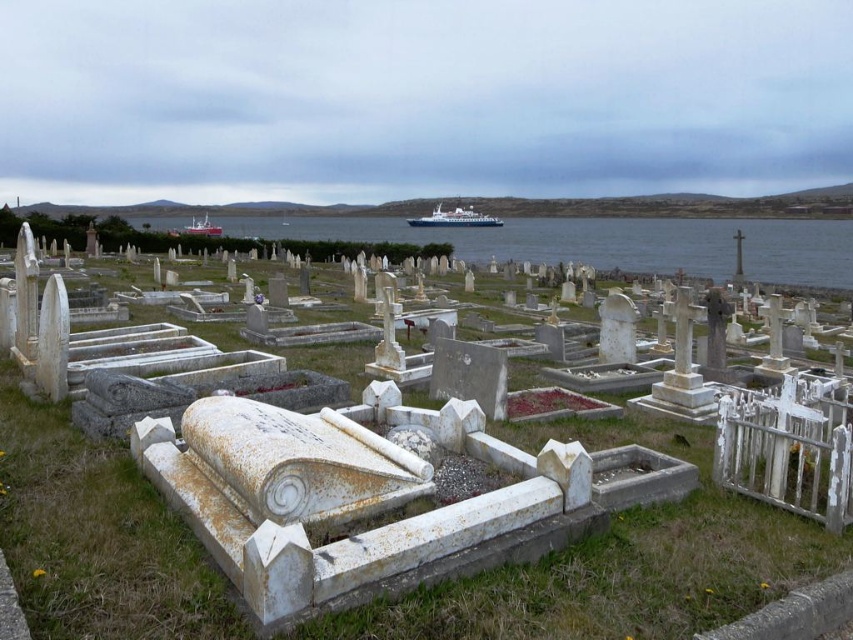
Question: Which point is farther from the camera taking this photo?

Choices:
 (A) (281, 220)
 (B) (438, 216)
 (C) (186, 230)
 (D) (137, 518)

Answer: (A)

Question: Is blue water at center further to the viewer compared to white glossy boat at center?

Choices:
 (A) yes
 (B) no

Answer: (B)

Question: Among these points, which one is nearest to the camera?

Choices:
 (A) (630, 452)
 (B) (218, 236)
 (C) (366, 221)

Answer: (A)

Question: Which object is farther from the camera taking this photo?

Choices:
 (A) white glossy boat at center
 (B) white plastic boat at center

Answer: (A)

Question: Observing the image, what is the correct spatial positioning of white marble tombstones at center in reference to white plastic boat at center?

Choices:
 (A) above
 (B) below

Answer: (B)

Question: In this image, where is white marble tombstones at center located relative to white plastic boat at center?

Choices:
 (A) above
 (B) below

Answer: (B)